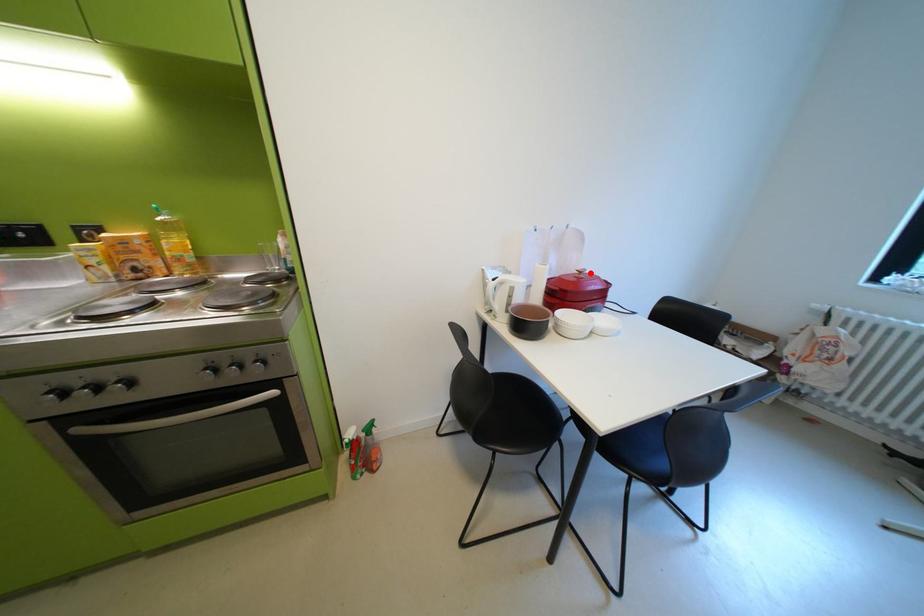
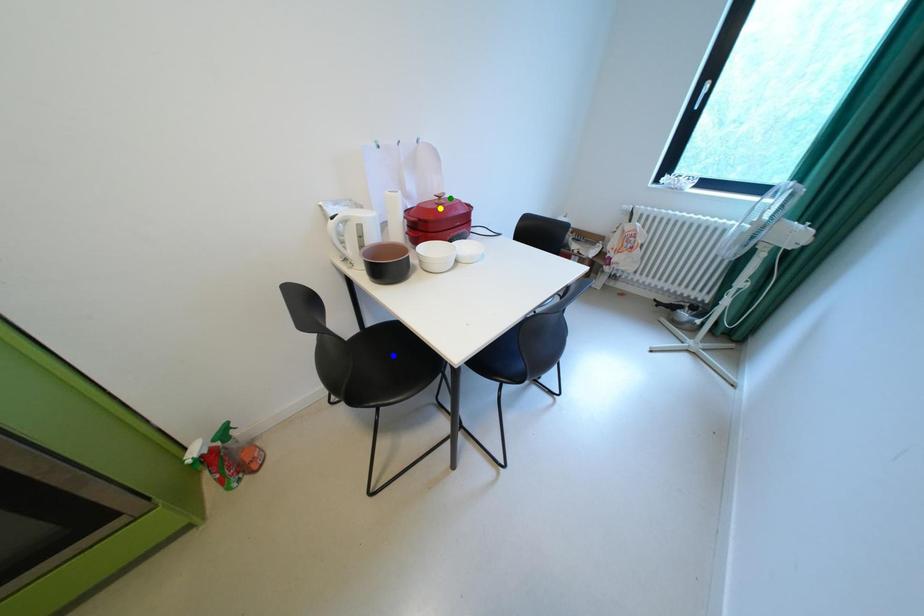
Question: I am providing you with two images of the same scene from different viewpoints. A red point is marked on the first image. You are given multiple points on the second image. In image 2, which mark is for the same physical point as the one in image 1?

Choices:
 (A) blue point
 (B) green point
 (C) yellow point

Answer: (B)